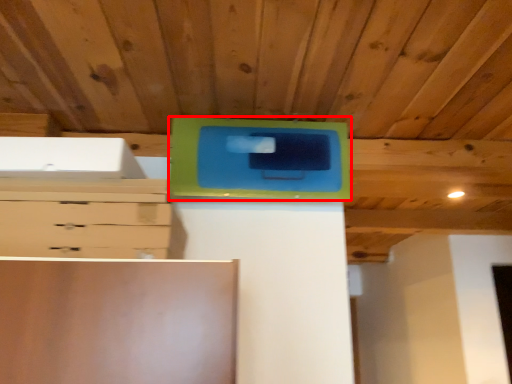
Question: From the image's perspective, where is cabinetry (annotated by the red box) located relative to chest of drawers?

Choices:
 (A) above
 (B) below

Answer: (A)